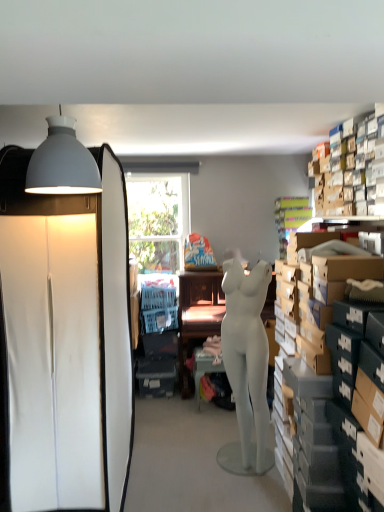
Measure the distance between point (42, 170) and camera.

The depth of point (42, 170) is 1.60 meters.

In order to click on white matte mannequin at center in this screenshot , I will do `click(247, 355)`.

What is the approximate width of white matte mannequin at center?

The width of white matte mannequin at center is 29.61 centimeters.

Locate an element on the screen. The height and width of the screenshot is (512, 384). white matte cabinet at left is located at coordinates (66, 340).

You are a GUI agent. You are given a task and a screenshot of the screen. Output one action in this format:
    pyautogui.click(x=<x>, y=<y>)
    Task: Click on the matte gray lampshade at upper left
    Image resolution: width=384 pixels, height=512 pixels.
    Given the screenshot: What is the action you would take?
    pyautogui.click(x=62, y=162)

Does matte gray table at center turn towards matte brown desk at center?

Yes, matte gray table at center is aimed at matte brown desk at center.

Locate an element on the screen. Image resolution: width=384 pixels, height=512 pixels. table that is under the matte brown desk at center (from a real-world perspective) is located at coordinates (203, 369).

Is matte gray table at center placed right next to matte brown desk at center?

matte gray table at center and matte brown desk at center are not in contact.

Which is closer, (x=199, y=395) or (x=184, y=274)?

Point (x=199, y=395) is closer to the camera than point (x=184, y=274).

Which is behind, matte gray table at center or matte gray lampshade at upper left?

matte gray table at center is further away from the camera.

Is matte gray table at center oriented towards matte gray lampshade at upper left?

No, matte gray table at center is not aimed at matte gray lampshade at upper left.

Which is less distant, (197, 356) or (49, 127)?

Clearly, point (197, 356) is more distant from the camera than point (49, 127).

Locate an element on the screen. This screenshot has height=512, width=384. lamp in front of the matte gray table at center is located at coordinates pos(62,162).

From a real-world perspective, who is located lower, white matte cabinet at left or matte brown desk at center?

matte brown desk at center is physically lower.

How different are the orientations of white matte cabinet at left and matte brown desk at center in degrees?

They differ by 0.572 degrees in their facing directions.

Would you consider white matte cabinet at left to be distant from matte brown desk at center?

Yes, white matte cabinet at left is far from matte brown desk at center.

Considering the relative sizes of matte gray lampshade at upper left and matte gray table at center in the image provided, is matte gray lampshade at upper left thinner than matte gray table at center?

Yes.

Can you confirm if matte gray lampshade at upper left is smaller than matte gray table at center?

Indeed, matte gray lampshade at upper left has a smaller size compared to matte gray table at center.

Which is in front, matte gray lampshade at upper left or matte gray table at center?

matte gray lampshade at upper left is more forward.

From their relative heights in the image, would you say matte gray lampshade at upper left is taller or shorter than matte gray table at center?

Considering their sizes, matte gray lampshade at upper left has less height than matte gray table at center.

Can you confirm if matte gray table at center is shorter than white matte cabinet at left?

Correct, matte gray table at center is not as tall as white matte cabinet at left.

From the image's perspective, which one is positioned higher, matte gray table at center or white matte cabinet at left?

white matte cabinet at left appears higher in the image.

Is point (215, 366) less distant than point (14, 509)?

No.

Which of these two, matte gray table at center or white matte cabinet at left, is wider?

white matte cabinet at left.

Between white matte mannequin at center and matte gray table at center, which one appears on the left side from the viewer's perspective?

From the viewer's perspective, matte gray table at center appears more on the left side.

Does white matte mannequin at center have a smaller size compared to matte gray table at center?

No, white matte mannequin at center is not smaller than matte gray table at center.

Looking at this image, from a real-world perspective, which object rests below the other?

From a 3D spatial view, matte gray table at center is below.

Based on the photo, could you tell me if white matte mannequin at center is turned towards matte gray table at center?

No, white matte mannequin at center is not oriented towards matte gray table at center.

Does white matte mannequin at center have a lesser width compared to matte gray lampshade at upper left?

Yes.

Image resolution: width=384 pixels, height=512 pixels. Find the location of `lamp located in front of the white matte mannequin at center`. lamp located in front of the white matte mannequin at center is located at coordinates (62, 162).

Which of these two, white matte mannequin at center or matte gray lampshade at upper left, stands taller?

white matte mannequin at center is taller.

At what (x,y) coordinates should I click in order to perform the action: click on table beneath the matte brown desk at center (from a real-world perspective). Please return your answer as a coordinate pair (x, y). The image size is (384, 512). Looking at the image, I should click on (203, 369).

Where is `lamp in front of the matte gray table at center`? lamp in front of the matte gray table at center is located at coordinates (62, 162).

Estimate the real-world distances between objects in this image. Which object is further from matte gray lampshade at upper left, white matte mannequin at center or matte gray table at center?

Among the two, matte gray table at center is located further to matte gray lampshade at upper left.

Estimate the real-world distances between objects in this image. Which object is closer to white matte mannequin at center, white matte cabinet at left or matte gray table at center?

white matte cabinet at left is closer to white matte mannequin at center.

Based on their spatial positions, is matte brown desk at center or white matte mannequin at center further from matte gray table at center?

white matte mannequin at center is further to matte gray table at center.

Considering their positions, is matte gray lampshade at upper left positioned closer to white matte mannequin at center than matte gray table at center?

The object closer to white matte mannequin at center is matte gray table at center.

From the image, which object appears to be nearer to white matte mannequin at center, matte gray lampshade at upper left or matte brown desk at center?

matte brown desk at center is positioned closer to the anchor white matte mannequin at center.

Looking at the image, which one is located further to matte gray table at center, matte brown desk at center or matte gray lampshade at upper left?

matte gray lampshade at upper left lies further to matte gray table at center than the other object.

From the image, which object appears to be nearer to matte brown desk at center, white matte cabinet at left or matte gray lampshade at upper left?

white matte cabinet at left is closer to matte brown desk at center.

Which object lies nearer to the anchor point matte brown desk at center, white matte mannequin at center or white matte cabinet at left?

white matte mannequin at center lies closer to matte brown desk at center than the other object.

Where is `cabinetry that lies between matte gray lampshade at upper left and white matte mannequin at center from top to bottom`? This screenshot has height=512, width=384. cabinetry that lies between matte gray lampshade at upper left and white matte mannequin at center from top to bottom is located at coordinates (66, 340).

The width and height of the screenshot is (384, 512). In order to click on person between white matte cabinet at left and matte gray table at center from front to back in this screenshot , I will do `click(247, 355)`.

Where is `person between matte gray lampshade at upper left and matte gray table at center in the front-back direction`? person between matte gray lampshade at upper left and matte gray table at center in the front-back direction is located at coordinates (247, 355).

Where is `person between matte gray lampshade at upper left and matte brown desk at center along the z-axis`? Image resolution: width=384 pixels, height=512 pixels. person between matte gray lampshade at upper left and matte brown desk at center along the z-axis is located at coordinates (247, 355).